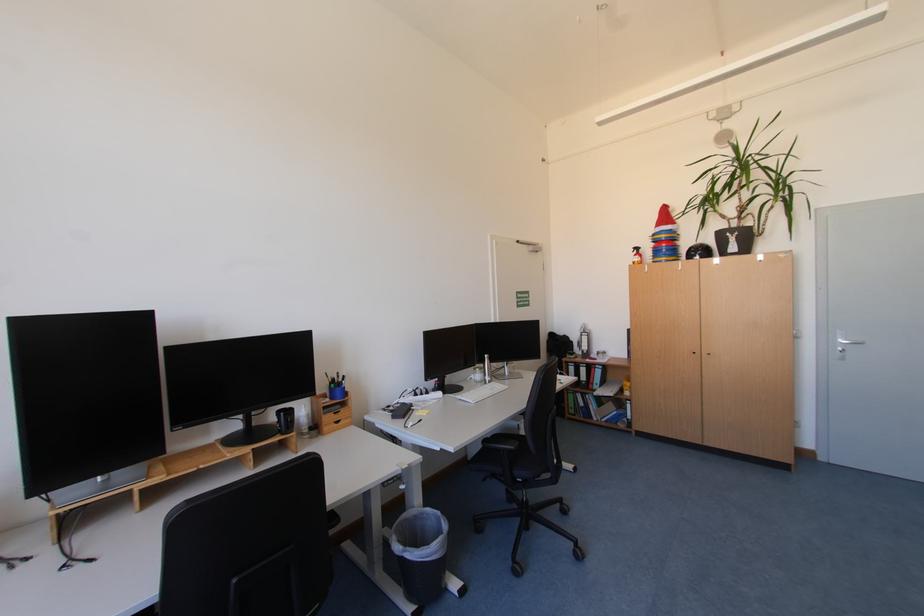
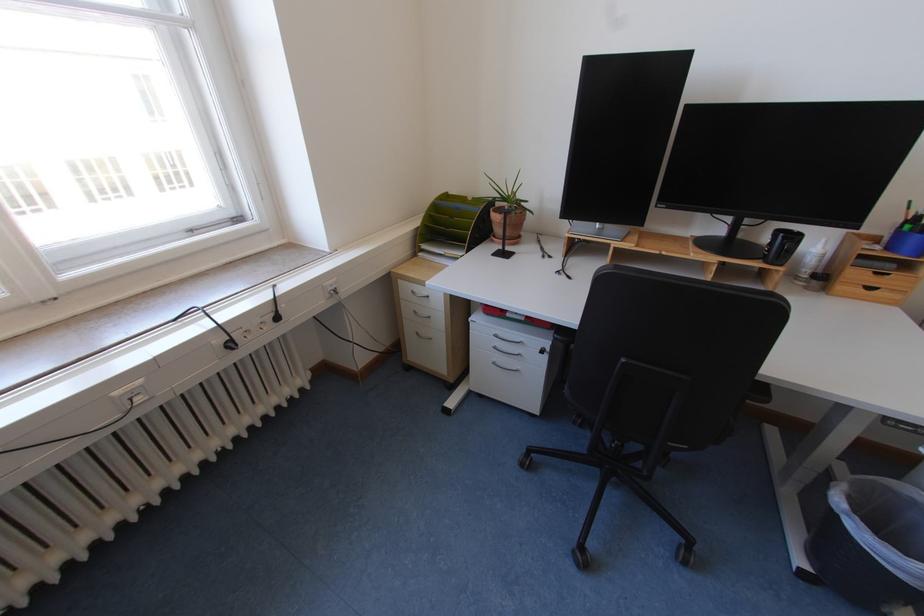
Locate, in the second image, the point that corresponds to (339,399) in the first image.

(896, 249)